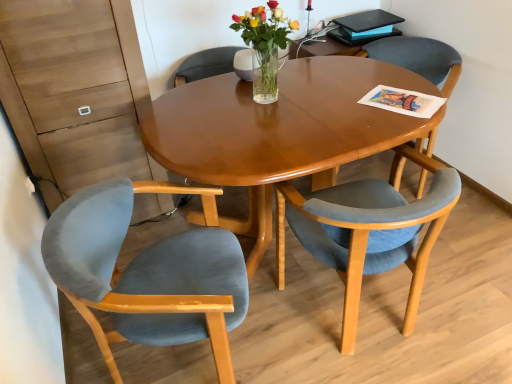
Based on the photo, measure the distance between point (360, 31) and camera.

The distance of point (360, 31) from camera is 8.26 feet.

What is the approximate width of velvet blue chair at lower right, which appears as the second chair when viewed from the right?

velvet blue chair at lower right, which appears as the second chair when viewed from the right, is 22.64 inches in width.

Describe the element at coordinates (419, 58) in the screenshot. I see `velvet blue chair at center, which is counted as the first chair, starting from the right` at that location.

Where is `matte black magazine at upper right`? matte black magazine at upper right is located at coordinates (368, 32).

Is velvet blue chair at center, which is counted as the first chair, starting from the right, far from velvet blue chair at lower left, the third chair viewed from the right?

Yes, velvet blue chair at center, which is counted as the first chair, starting from the right, is far from velvet blue chair at lower left, the third chair viewed from the right.

Could you tell me if velvet blue chair at center, which is counted as the first chair, starting from the right, is facing velvet blue chair at lower left, the third chair viewed from the right?

Yes, velvet blue chair at center, which is counted as the first chair, starting from the right, is turned towards velvet blue chair at lower left, the third chair viewed from the right.

Considering the positions of objects velvet blue chair at center, which is counted as the first chair, starting from the right, and velvet blue chair at lower left, the third chair viewed from the right, in the image provided, who is in front, velvet blue chair at center, which is counted as the first chair, starting from the right, or velvet blue chair at lower left, the third chair viewed from the right,?

velvet blue chair at lower left, the third chair viewed from the right.

Is point (456, 64) in front of point (133, 332)?

No, it is behind (133, 332).

Does clear glass vase at center have a lesser width compared to velvet blue chair at lower left, the third chair viewed from the right?

Yes.

How many degrees apart are the facing directions of clear glass vase at center and velvet blue chair at lower left, the third chair viewed from the right?

72.3 degrees separate the facing orientations of clear glass vase at center and velvet blue chair at lower left, the third chair viewed from the right.

Locate an element on the screen. The width and height of the screenshot is (512, 384). floral arrangement positioned vertically above the velvet blue chair at lower left, the third chair viewed from the right (from a real-world perspective) is located at coordinates (265, 46).

In the scene shown: Considering the positions of objects clear glass vase at center and velvet blue chair at lower left, the third chair viewed from the right, in the image provided, who is more to the left, clear glass vase at center or velvet blue chair at lower left, the third chair viewed from the right,?

velvet blue chair at lower left, the third chair viewed from the right, is more to the left.

Is velvet blue chair at center, the 3th chair in the left-to-right sequence, oriented towards clear glass vase at center?

Yes, velvet blue chair at center, the 3th chair in the left-to-right sequence, faces towards clear glass vase at center.

Looking at the image, does velvet blue chair at center, the 3th chair in the left-to-right sequence, seem bigger or smaller compared to clear glass vase at center?

Considering their sizes, velvet blue chair at center, the 3th chair in the left-to-right sequence, takes up more space than clear glass vase at center.

Could you measure the distance between velvet blue chair at center, which is counted as the first chair, starting from the right, and clear glass vase at center?

35.14 inches.

Is clear glass vase at center surrounded by velvet blue chair at center, which is counted as the first chair, starting from the right?

No, clear glass vase at center is not a part of velvet blue chair at center, which is counted as the first chair, starting from the right.

Is velvet blue chair at lower left, placed as the 1th chair when sorted from left to right, wider or thinner than clear glass vase at center?

In the image, velvet blue chair at lower left, placed as the 1th chair when sorted from left to right, appears to be wider than clear glass vase at center.

Would you say clear glass vase at center is part of velvet blue chair at lower left, placed as the 1th chair when sorted from left to right,'s contents?

Actually, clear glass vase at center is outside velvet blue chair at lower left, placed as the 1th chair when sorted from left to right.

Looking at this image, which point is more distant from viewer, (x=238, y=251) or (x=268, y=44)?

The point (x=268, y=44) is farther.

Can you confirm if velvet blue chair at lower left, placed as the 1th chair when sorted from left to right, is smaller than velvet blue chair at lower right, arranged as the second chair when viewed from the left?

Yes.

Is velvet blue chair at lower left, the third chair viewed from the right, turned away from velvet blue chair at lower right, which appears as the second chair when viewed from the right?

No.

Is velvet blue chair at lower left, placed as the 1th chair when sorted from left to right, not inside velvet blue chair at lower right, arranged as the second chair when viewed from the left?

Indeed, velvet blue chair at lower left, placed as the 1th chair when sorted from left to right, is completely outside velvet blue chair at lower right, arranged as the second chair when viewed from the left.

Find the location of a particular element. This screenshot has width=512, height=384. the 1st chair behind the velvet blue chair at lower left, placed as the 1th chair when sorted from left to right is located at coordinates (367, 230).

Is velvet blue chair at center, which is counted as the first chair, starting from the right, oriented towards velvet blue chair at lower right, which appears as the second chair when viewed from the right?

Yes, velvet blue chair at center, which is counted as the first chair, starting from the right, faces towards velvet blue chair at lower right, which appears as the second chair when viewed from the right.

From the picture: Is velvet blue chair at center, the 3th chair in the left-to-right sequence, to the right of velvet blue chair at lower right, which appears as the second chair when viewed from the right, from the viewer's perspective?

Yes, velvet blue chair at center, the 3th chair in the left-to-right sequence, is to the right of velvet blue chair at lower right, which appears as the second chair when viewed from the right.

From a real-world perspective, count 1st chairs downward from the velvet blue chair at center, the 3th chair in the left-to-right sequence, and point to it. Please provide its 2D coordinates.

[(367, 230)]

In the scene shown: Is the depth of velvet blue chair at center, the 3th chair in the left-to-right sequence, less than that of velvet blue chair at lower right, arranged as the second chair when viewed from the left?

No, velvet blue chair at center, the 3th chair in the left-to-right sequence, is further to the viewer.

Does velvet blue chair at lower left, the third chair viewed from the right, turn towards matte black magazine at upper right?

No, velvet blue chair at lower left, the third chair viewed from the right, is not aimed at matte black magazine at upper right.

From the image's perspective, is velvet blue chair at lower left, placed as the 1th chair when sorted from left to right, positioned above or below matte black magazine at upper right?

velvet blue chair at lower left, placed as the 1th chair when sorted from left to right, is situated lower than matte black magazine at upper right in the image.

Consider the image. Can you confirm if velvet blue chair at lower left, the third chair viewed from the right, is wider than matte black magazine at upper right?

Correct, the width of velvet blue chair at lower left, the third chair viewed from the right, exceeds that of matte black magazine at upper right.

Where is `the 2nd chair behind when counting from the velvet blue chair at lower left, placed as the 1th chair when sorted from left to right`? The image size is (512, 384). the 2nd chair behind when counting from the velvet blue chair at lower left, placed as the 1th chair when sorted from left to right is located at coordinates (419, 58).

Where is `the 3rd chair positioned below the clear glass vase at center (from the image's perspective)`? The width and height of the screenshot is (512, 384). the 3rd chair positioned below the clear glass vase at center (from the image's perspective) is located at coordinates (146, 275).

Estimate the real-world distances between objects in this image. Which object is further from velvet blue chair at lower right, arranged as the second chair when viewed from the left, velvet blue chair at lower left, the third chair viewed from the right, or matte black magazine at upper right?

The object further to velvet blue chair at lower right, arranged as the second chair when viewed from the left, is matte black magazine at upper right.

Estimate the real-world distances between objects in this image. Which object is closer to clear glass vase at center, velvet blue chair at lower left, the third chair viewed from the right, or velvet blue chair at center, the 3th chair in the left-to-right sequence?

Based on the image, velvet blue chair at lower left, the third chair viewed from the right, appears to be nearer to clear glass vase at center.

Looking at the image, which one is located closer to velvet blue chair at lower left, placed as the 1th chair when sorted from left to right, clear glass vase at center or velvet blue chair at lower right, arranged as the second chair when viewed from the left?

velvet blue chair at lower right, arranged as the second chair when viewed from the left, is positioned closer to the anchor velvet blue chair at lower left, placed as the 1th chair when sorted from left to right.

Looking at this image, looking at the image, which one is located closer to matte black magazine at upper right, velvet blue chair at center, which is counted as the first chair, starting from the right, or velvet blue chair at lower left, placed as the 1th chair when sorted from left to right?

velvet blue chair at center, which is counted as the first chair, starting from the right, is positioned closer to the anchor matte black magazine at upper right.

From the image, which object appears to be farther from velvet blue chair at lower right, arranged as the second chair when viewed from the left, clear glass vase at center or velvet blue chair at lower left, the third chair viewed from the right?

Based on the image, clear glass vase at center appears to be further to velvet blue chair at lower right, arranged as the second chair when viewed from the left.

Which object lies further to the anchor point velvet blue chair at lower left, placed as the 1th chair when sorted from left to right, velvet blue chair at center, which is counted as the first chair, starting from the right, or clear glass vase at center?

velvet blue chair at center, which is counted as the first chair, starting from the right, lies further to velvet blue chair at lower left, placed as the 1th chair when sorted from left to right, than the other object.

Considering their positions, is velvet blue chair at lower left, the third chair viewed from the right, positioned closer to velvet blue chair at center, which is counted as the first chair, starting from the right, than velvet blue chair at lower right, which appears as the second chair when viewed from the right?

The object closer to velvet blue chair at center, which is counted as the first chair, starting from the right, is velvet blue chair at lower right, which appears as the second chair when viewed from the right.

Looking at the image, which one is located further to matte black magazine at upper right, velvet blue chair at center, which is counted as the first chair, starting from the right, or clear glass vase at center?

clear glass vase at center is further to matte black magazine at upper right.

At what (x,y) coordinates should I click in order to perform the action: click on chair situated between velvet blue chair at lower left, placed as the 1th chair when sorted from left to right, and velvet blue chair at center, which is counted as the first chair, starting from the right, from left to right. Please return your answer as a coordinate pair (x, y). This screenshot has width=512, height=384. Looking at the image, I should click on (367, 230).

Identify the location of floral arrangement located between velvet blue chair at lower left, placed as the 1th chair when sorted from left to right, and velvet blue chair at center, which is counted as the first chair, starting from the right, in the left-right direction. (265, 46).

You are a GUI agent. You are given a task and a screenshot of the screen. Output one action in this format:
    pyautogui.click(x=<x>, y=<y>)
    Task: Click on the chair positioned between clear glass vase at center and matte black magazine at upper right from near to far
    The height and width of the screenshot is (384, 512).
    Given the screenshot: What is the action you would take?
    pyautogui.click(x=419, y=58)

Where is `floral arrangement located between velvet blue chair at lower left, the third chair viewed from the right, and matte black magazine at upper right in the depth direction`? Image resolution: width=512 pixels, height=384 pixels. floral arrangement located between velvet blue chair at lower left, the third chair viewed from the right, and matte black magazine at upper right in the depth direction is located at coordinates (265, 46).